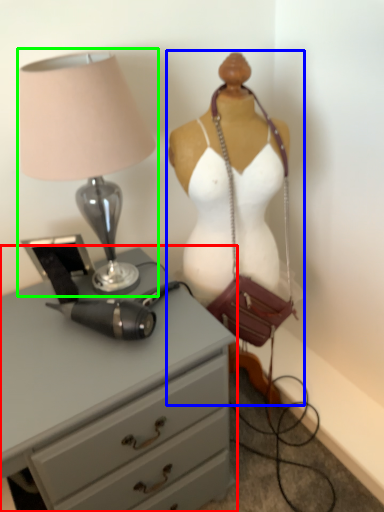
Question: Which is farther away from chest of drawers (highlighted by a red box)? mannequin (highlighted by a blue box) or lamp (highlighted by a green box)?

Choices:
 (A) mannequin
 (B) lamp

Answer: (B)